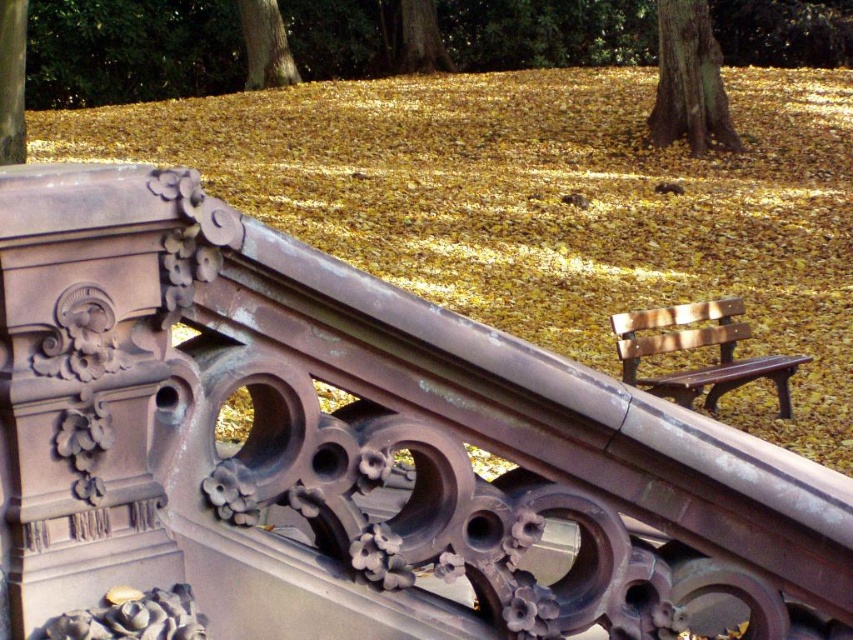
You are standing at the point with coordinates (697, 348) in the image. What object is located exactly at that point?

The wooden bench at center is located exactly at the point with coordinates (697, 348).